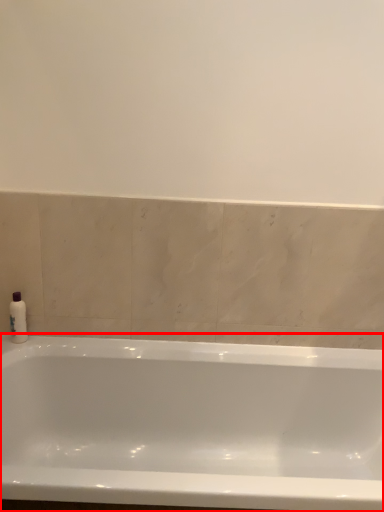
Question: Observing the image, what is the correct spatial positioning of bathtub (annotated by the red box) in reference to soap dispenser?

Choices:
 (A) right
 (B) left

Answer: (A)